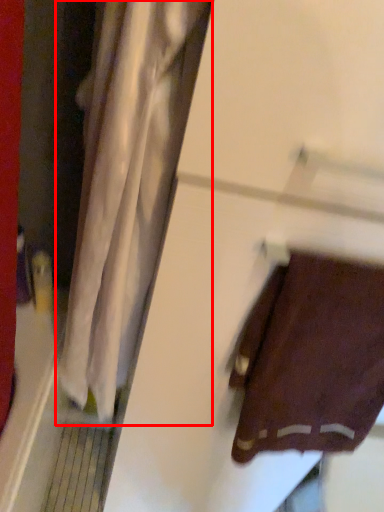
Question: From the image's perspective, where is curtain (annotated by the red box) located relative to towel?

Choices:
 (A) above
 (B) below

Answer: (A)